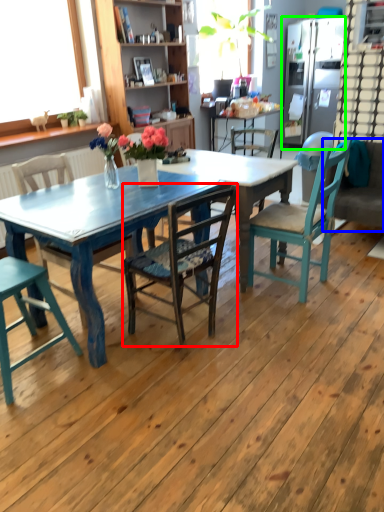
Question: Which object is positioned closest to chair (highlighted by a red box)? Select from couch (highlighted by a blue box) and refrigerator (highlighted by a green box).

Choices:
 (A) couch
 (B) refrigerator

Answer: (A)